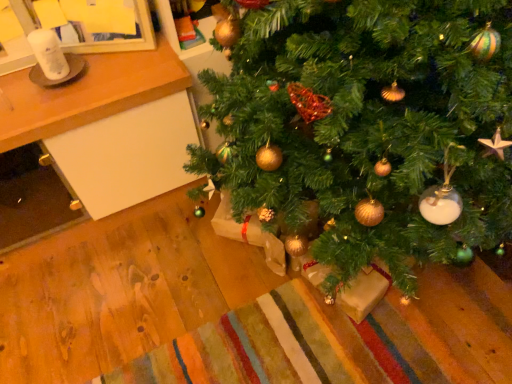
Question: Looking at their shapes, would you say wooden table at lower left is wider or thinner than green matte christmas tree at center?

Choices:
 (A) thin
 (B) wide

Answer: (A)

Question: Is wooden table at lower left inside or outside of green matte christmas tree at center?

Choices:
 (A) outside
 (B) inside

Answer: (A)

Question: Is point (77, 115) closer or farther from the camera than point (374, 114)?

Choices:
 (A) closer
 (B) farther

Answer: (B)

Question: In terms of width, does green matte christmas tree at center look wider or thinner when compared to wooden table at lower left?

Choices:
 (A) wide
 (B) thin

Answer: (A)

Question: Is green matte christmas tree at center in front of or behind wooden table at lower left in the image?

Choices:
 (A) behind
 (B) front

Answer: (B)

Question: Is green matte christmas tree at center taller or shorter than wooden table at lower left?

Choices:
 (A) tall
 (B) short

Answer: (A)

Question: Considering the positions of point (337, 29) and point (95, 163), is point (337, 29) closer or farther from the camera than point (95, 163)?

Choices:
 (A) farther
 (B) closer

Answer: (B)